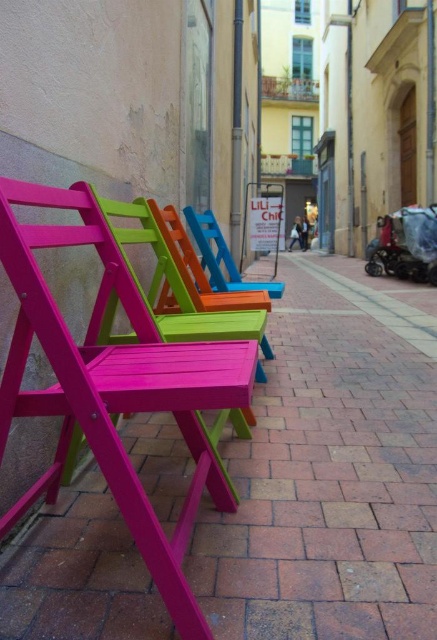
Between point (423, 572) and point (277, 292), which one is positioned behind?

Positioned behind is point (277, 292).

Does matte wood chairs at left appear on the left side of matte blue wood chair at center?

Incorrect, matte wood chairs at left is not on the left side of matte blue wood chair at center.

Which is behind, point (298, 330) or point (263, 282)?

The point (263, 282) is behind.

Locate an element on the screen. matte wood chairs at left is located at coordinates (332, 470).

Is matte wood chairs at left above matte pink wood chair at center?

Actually, matte wood chairs at left is below matte pink wood chair at center.

Can you confirm if matte wood chairs at left is wider than matte pink wood chair at center?

Yes, matte wood chairs at left is wider than matte pink wood chair at center.

Is point (395, 566) positioned behind point (219, 292)?

No, (395, 566) is closer to viewer.

I want to click on matte wood chairs at left, so click(332, 470).

Is matte pink wood chair at center taller than matte blue wood chair at center?

Indeed, matte pink wood chair at center has a greater height compared to matte blue wood chair at center.

Does point (159, 301) lie in front of point (225, 266)?

Yes.

This screenshot has height=640, width=437. What are the coordinates of `matte pink wood chair at center` in the screenshot? It's located at (200, 268).